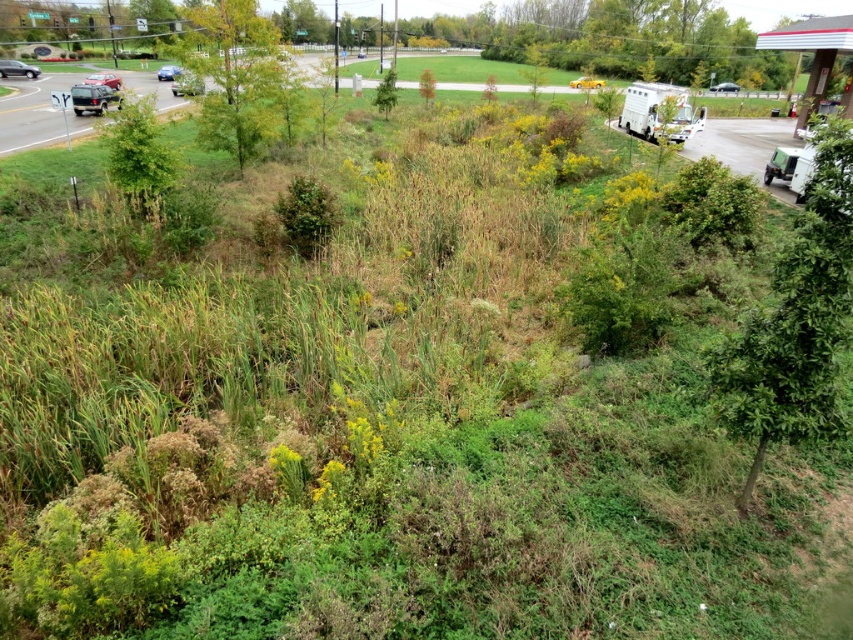
Based on the photo, which of these two, matte black suv at upper left or yellow plastic recreational vehicle at upper center, stands shorter?

matte black suv at upper left is shorter.

Does matte black suv at upper left have a smaller size compared to yellow plastic recreational vehicle at upper center?

Correct, matte black suv at upper left occupies less space than yellow plastic recreational vehicle at upper center.

This screenshot has width=853, height=640. I want to click on matte black suv at upper left, so click(16, 68).

Can you confirm if white matte van at upper right is positioned above matte black truck at upper left?

No, white matte van at upper right is not above matte black truck at upper left.

Describe the element at coordinates (791, 168) in the screenshot. I see `white matte van at upper right` at that location.

Image resolution: width=853 pixels, height=640 pixels. I want to click on white matte van at upper right, so click(791, 168).

Does green leafy tree at upper left have a lesser height compared to matte black suv at upper left?

No.

Find the location of a particular element. green leafy tree at upper left is located at coordinates (239, 77).

Image resolution: width=853 pixels, height=640 pixels. What do you see at coordinates (239, 77) in the screenshot?
I see `green leafy tree at upper left` at bounding box center [239, 77].

What are the coordinates of `green leafy tree at upper left` in the screenshot? It's located at (239, 77).